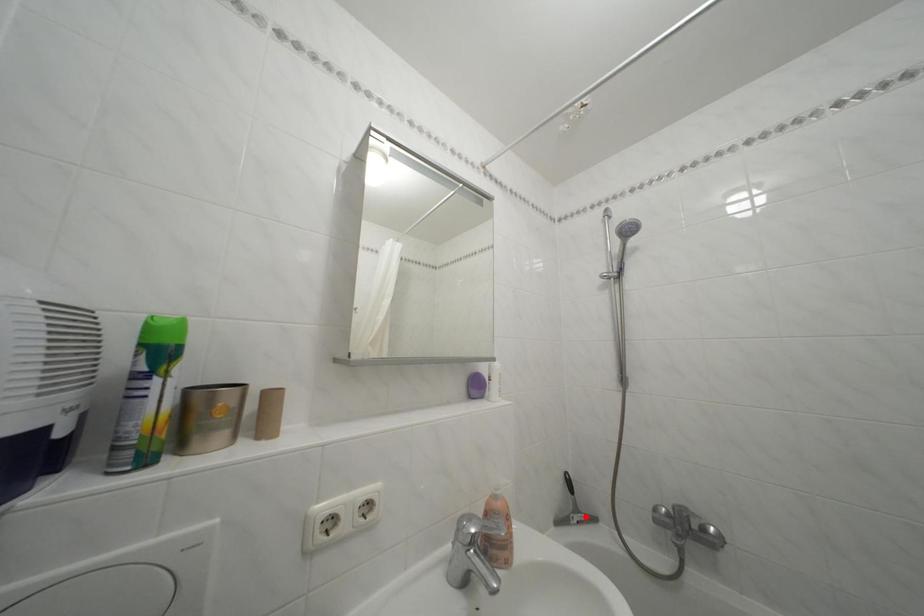
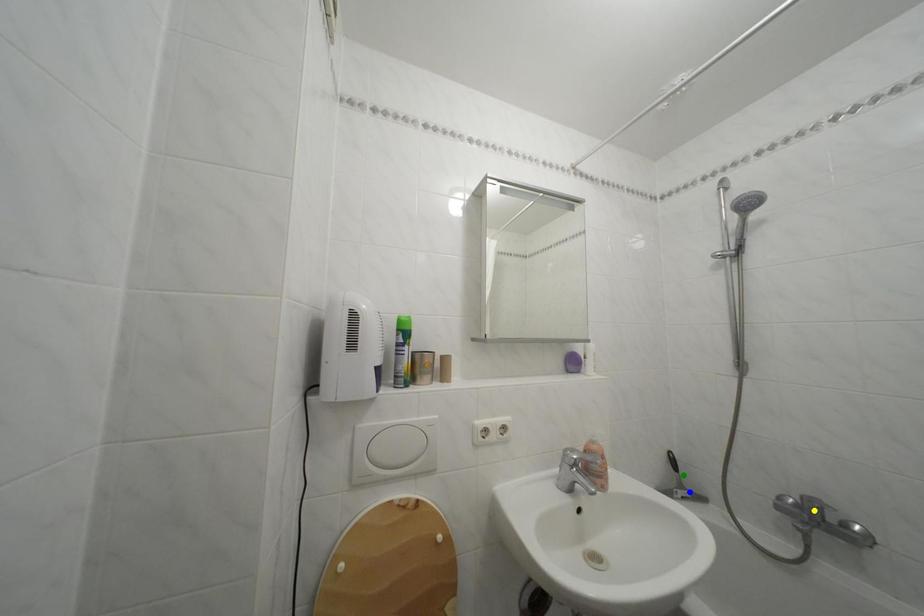
Question: I am providing you with two images of the same scene from different viewpoints. A red point is marked on the first image. You are given multiple points on the second image. Which mark in image 2 goes with the point in image 1?

Choices:
 (A) yellow point
 (B) green point
 (C) blue point

Answer: (C)